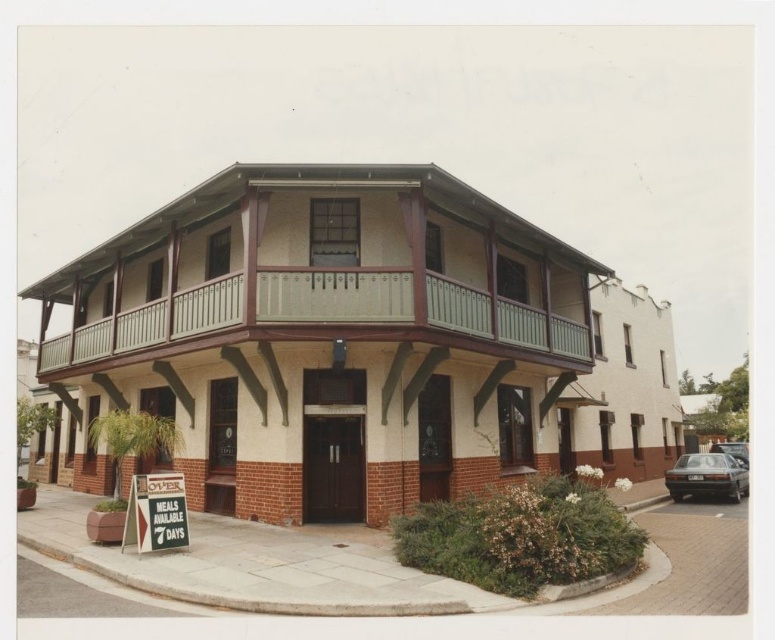
You are standing at the entrance of the building and want to move to the metallic silver car at lower right. Is the green painted wood at upper center closer to you than the car?

The green painted wood at upper center is 15.69 meters away from the metallic silver car at lower right. Since you are at the entrance, the distance from you to the car would depend on your position. However, the question asks if the green painted wood is closer to you than the car. Without knowing the exact positions, it is impossible to determine this. Please provide more information about your location relative to both objects.

You are standing directly in front of the building and want to locate the green painted wood at upper center. Based on the coordinates provided, where should you look relative to the center of the image?

The green painted wood at upper center is located at coordinates approximately 49.4 percent from the left edge and 41.3 percent from the bottom edge of the image.

You are a delivery person standing at the entrance of the two story building. You need to park your 15 feet long truck between the green painted wood at upper center and the dark gray metallic sedan at lower right. Is there enough space?

The distance between the green painted wood at upper center and the dark gray metallic sedan at lower right is 37.06 feet. Since the truck is 15 feet long, there is sufficient space to park it between them.